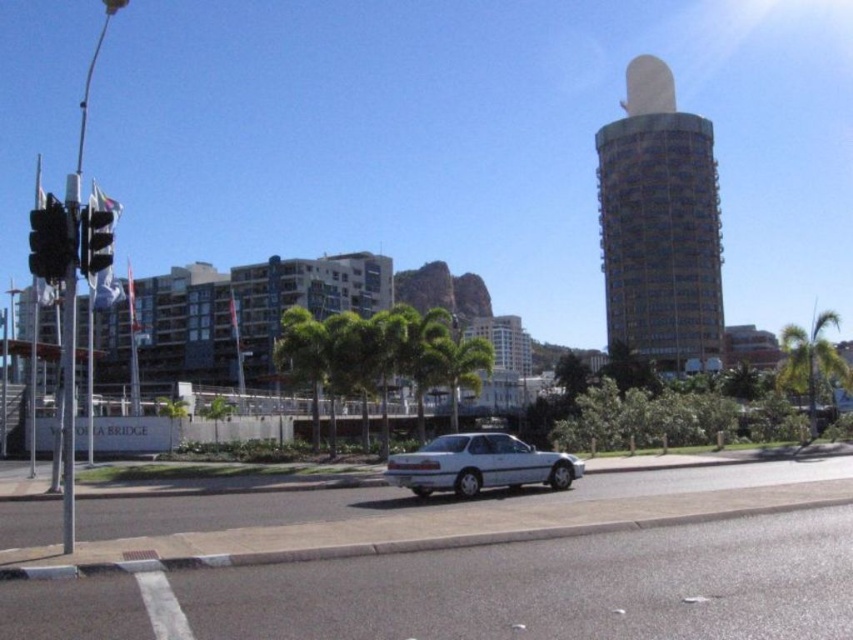
Measure the distance between black plastic traffic light at left and metallic traffic light at left.

black plastic traffic light at left and metallic traffic light at left are 1.60 meters apart from each other.

Is black plastic traffic light at left behind metallic traffic light at left?

No.

Between point (33, 262) and point (105, 243), which one is positioned behind?

The point (105, 243) is behind.

At what (x,y) coordinates should I click in order to perform the action: click on black plastic traffic light at left. Please return your answer as a coordinate pair (x, y). The width and height of the screenshot is (853, 640). Looking at the image, I should click on (50, 241).

Which is more to the right, white metallic car at center or green leafy palm tree at center?

Positioned to the right is green leafy palm tree at center.

What do you see at coordinates (479, 465) in the screenshot?
I see `white metallic car at center` at bounding box center [479, 465].

Who is more distant from viewer, (445, 454) or (456, 348)?

Point (456, 348)

The height and width of the screenshot is (640, 853). I want to click on white metallic car at center, so click(x=479, y=465).

Find the location of a particular element. green leafy palm tree at right is located at coordinates (810, 360).

Based on the photo, who is more distant from viewer, (811,360) or (434,376)?

Point (811,360)

What do you see at coordinates (810, 360) in the screenshot?
I see `green leafy palm tree at right` at bounding box center [810, 360].

This screenshot has width=853, height=640. What are the coordinates of `green leafy palm tree at right` in the screenshot? It's located at click(x=810, y=360).